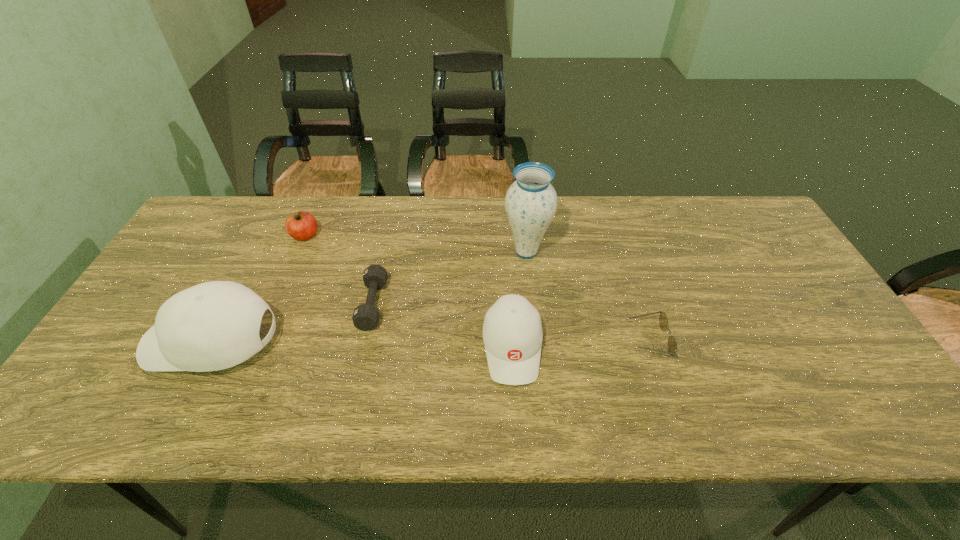
Find the location of `object present at the near left corner`. object present at the near left corner is located at coordinates (215, 325).

Where is `vacant region at the far edge`? vacant region at the far edge is located at coordinates (709, 230).

This screenshot has height=540, width=960. I want to click on vacant position at the near edge of the desktop, so click(x=295, y=382).

In the image, there is a desktop. In order to click on vacant area at the left edge in this screenshot , I will do `click(166, 288)`.

In the image, there is a desktop. Where is `vacant space at the right edge`? The height and width of the screenshot is (540, 960). vacant space at the right edge is located at coordinates (801, 286).

You are a GUI agent. You are given a task and a screenshot of the screen. Output one action in this format:
    pyautogui.click(x=<x>, y=<y>)
    Task: Click on the free space at the far left corner of the desktop
    This screenshot has height=540, width=960.
    Given the screenshot: What is the action you would take?
    pyautogui.click(x=227, y=226)

You are a GUI agent. You are given a task and a screenshot of the screen. Output one action in this format:
    pyautogui.click(x=<x>, y=<y>)
    Task: Click on the vacant region at the far right corner of the desktop
    The image size is (960, 540).
    Given the screenshot: What is the action you would take?
    pyautogui.click(x=732, y=241)

Where is `vacant area that lies between the shortest object and the fourth tallest object`? Image resolution: width=960 pixels, height=540 pixels. vacant area that lies between the shortest object and the fourth tallest object is located at coordinates (476, 288).

Locate an element on the screen. This screenshot has width=960, height=540. blank region between the left baseball cap and the dumbbell is located at coordinates (293, 323).

Find the location of `vacant area that lies between the shortest object and the vase`. vacant area that lies between the shortest object and the vase is located at coordinates (587, 296).